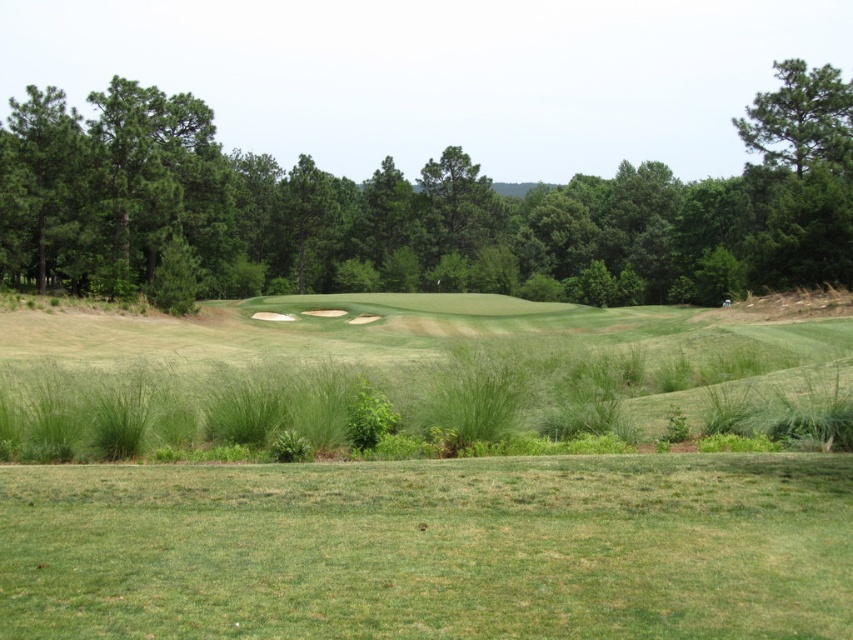
You are a golfer trying to determine the best path for your shot. You notice two trees in the background of the golf course. Which tree, the green leafy tree at upper center or the green textured tree at upper right, is wider?

The green textured tree at upper right is wider than the green leafy tree at upper center.

You are a golfer standing on the fairway and notice two trees in the background. The first is a green leafy tree at upper center, and the second is a green textured tree at upper right. From your perspective, which tree is positioned to the right side?

The green textured tree at upper right is positioned to the right side because the green leafy tree at upper center is to its left.

You are a golfer standing at the tee box and see two points on the golf course. The first point is labeled as point (366, 588) and the second is point (305, 253). Which of these two points is closer to your current position?

Point (366, 588) is in front of point (305, 253), so it is closer to your current position.